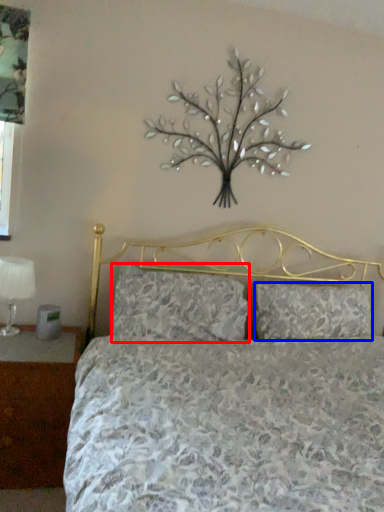
Question: Which of the following is the farthest to the observer, pillow (highlighted by a red box) or pillow (highlighted by a blue box)?

Choices:
 (A) pillow
 (B) pillow

Answer: (B)